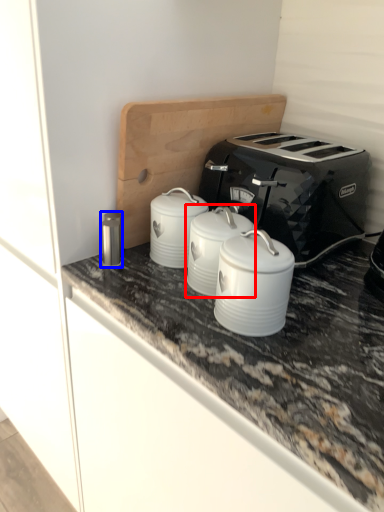
Question: Which object is further to the camera taking this photo, appliance (highlighted by a red box) or appliance (highlighted by a blue box)?

Choices:
 (A) appliance
 (B) appliance

Answer: (B)